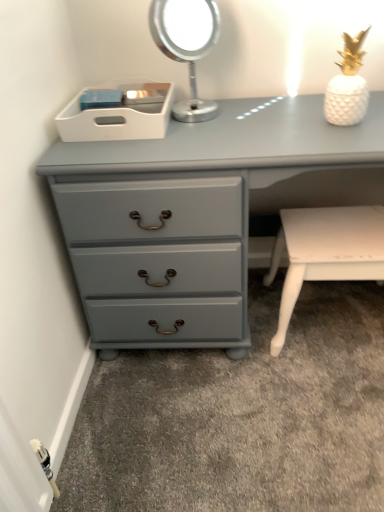
Find the location of `unoccupied area in front of white plastic tray at upper center`. unoccupied area in front of white plastic tray at upper center is located at coordinates [119, 148].